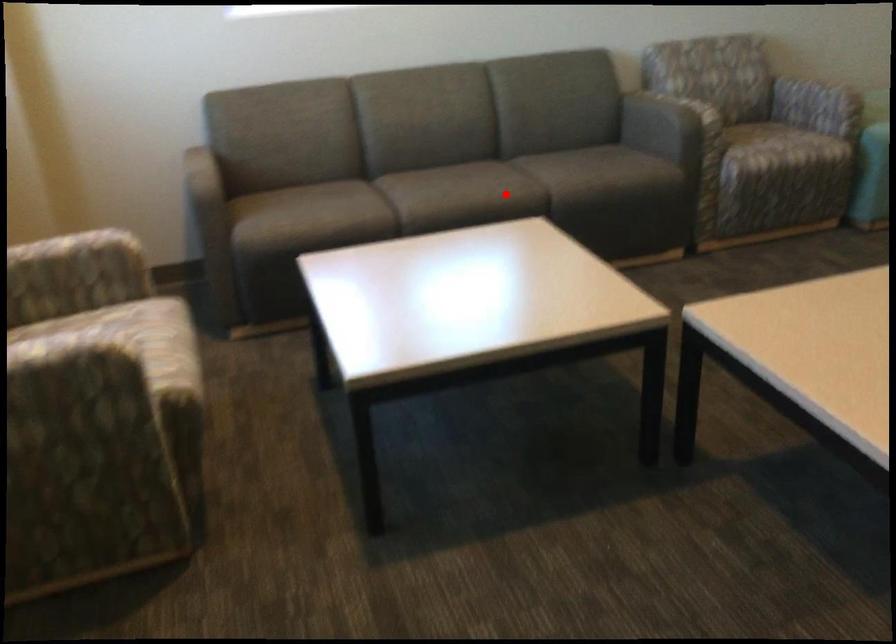
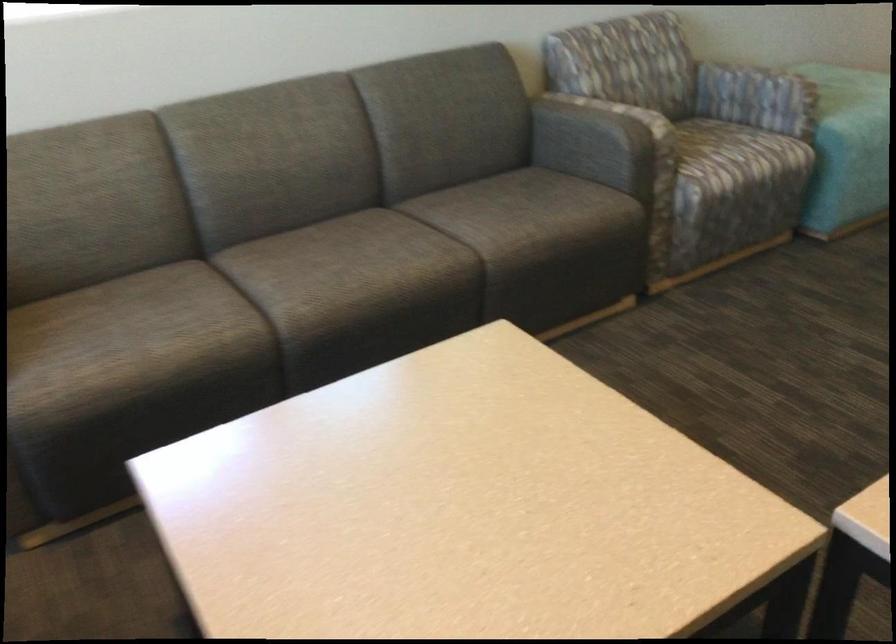
Question: A red point is marked in image1. In image2, is the corresponding 3D point closer to the camera or farther? Reply with the corresponding letter.

Choices:
 (A) The corresponding 3D point is closer.
 (B) The corresponding 3D point is farther.

Answer: (A)